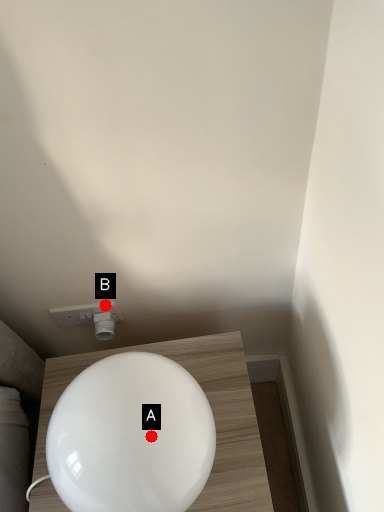
Question: Two points are circled on the image, labeled by A and B beside each circle. Which point is further to the camera?

Choices:
 (A) A is further
 (B) B is further

Answer: (B)